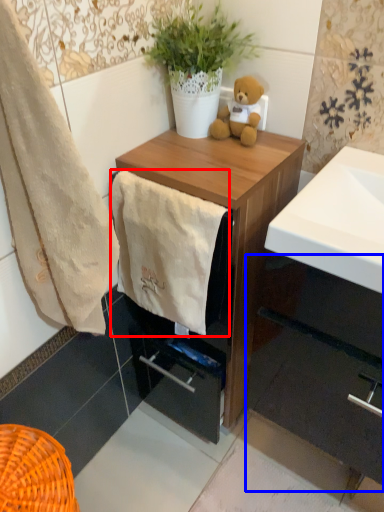
Question: Which point is closer to the camera, towel/napkin (highlighted by a red box) or cabinetry (highlighted by a blue box)?

Choices:
 (A) towel/napkin
 (B) cabinetry

Answer: (A)